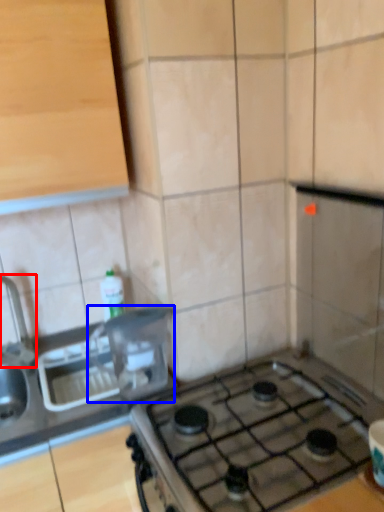
Question: Among these objects, which one is farthest to the camera, faucet (highlighted by a red box) or appliance (highlighted by a blue box)?

Choices:
 (A) faucet
 (B) appliance

Answer: (A)